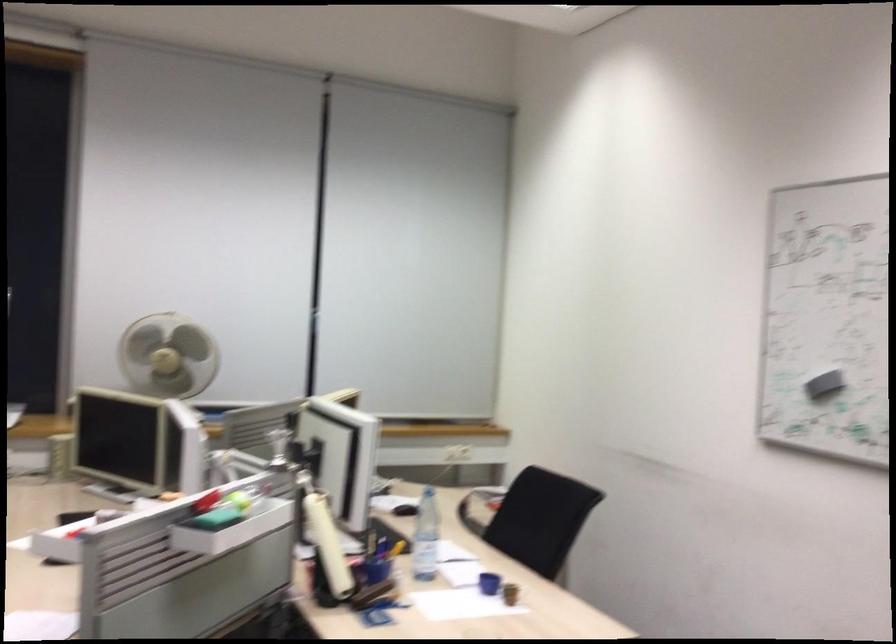
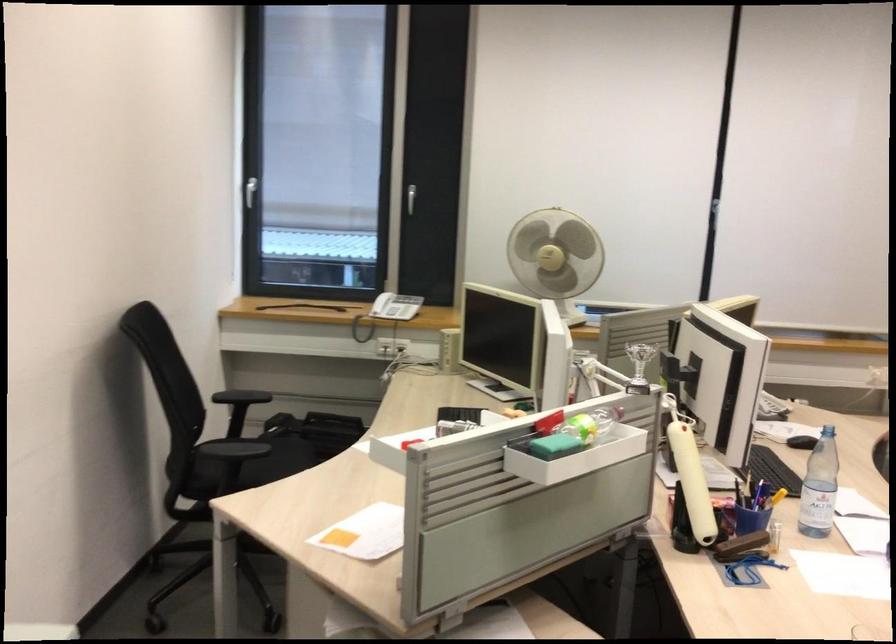
Question: I am providing you with two images of the same scene from different viewpoints. Which of the following objects are not visible in image2?

Choices:
 (A) white window handle
 (B) telephone handset
 (C) black chair armrest
 (D) none of these

Answer: (D)